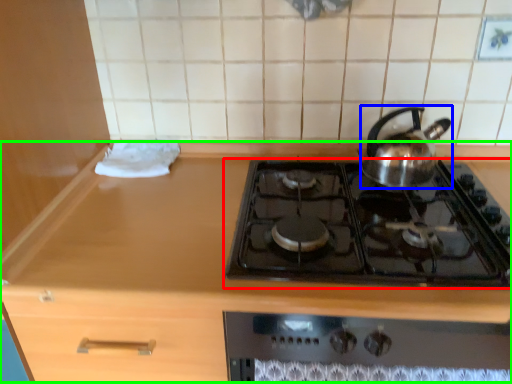
Question: Estimate the real-world distances between objects in this image. Which object is farther from gas stove (highlighted by a red box), kettle (highlighted by a blue box) or counter (highlighted by a green box)?

Choices:
 (A) kettle
 (B) counter

Answer: (B)